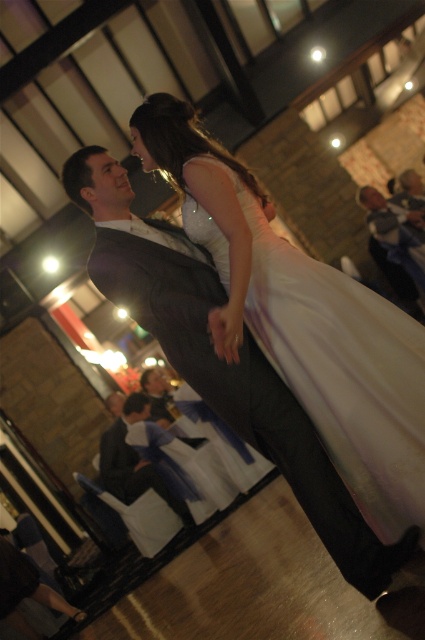
Question: Does white satin dress at center come behind dark gray suit at lower center?

Choices:
 (A) no
 (B) yes

Answer: (A)

Question: Among these points, which one is nearest to the camera?

Choices:
 (A) (393, 205)
 (B) (113, 440)

Answer: (B)

Question: Is dark gray suit at lower right to the right of dark gray suit at lower center from the viewer's perspective?

Choices:
 (A) yes
 (B) no

Answer: (A)

Question: Among these objects, which one is nearest to the camera?

Choices:
 (A) white satin dress at center
 (B) dark gray suit at lower center

Answer: (A)

Question: Is white satin dress at center further to camera compared to dark gray suit at lower right?

Choices:
 (A) no
 (B) yes

Answer: (A)

Question: Among these points, which one is farthest from the camera?

Choices:
 (A) [x=138, y=477]
 (B) [x=198, y=225]

Answer: (A)